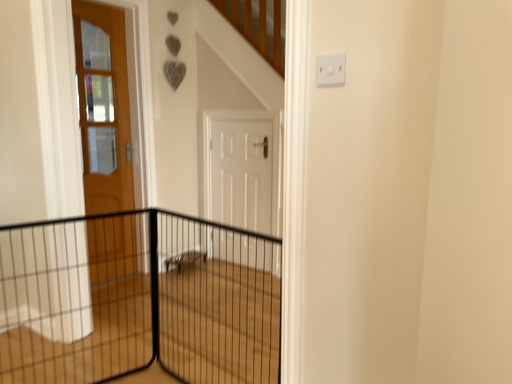
In order to click on vacant area that is in front of white matte door at center, which is the first door in right-to-left order in this screenshot , I will do `click(245, 279)`.